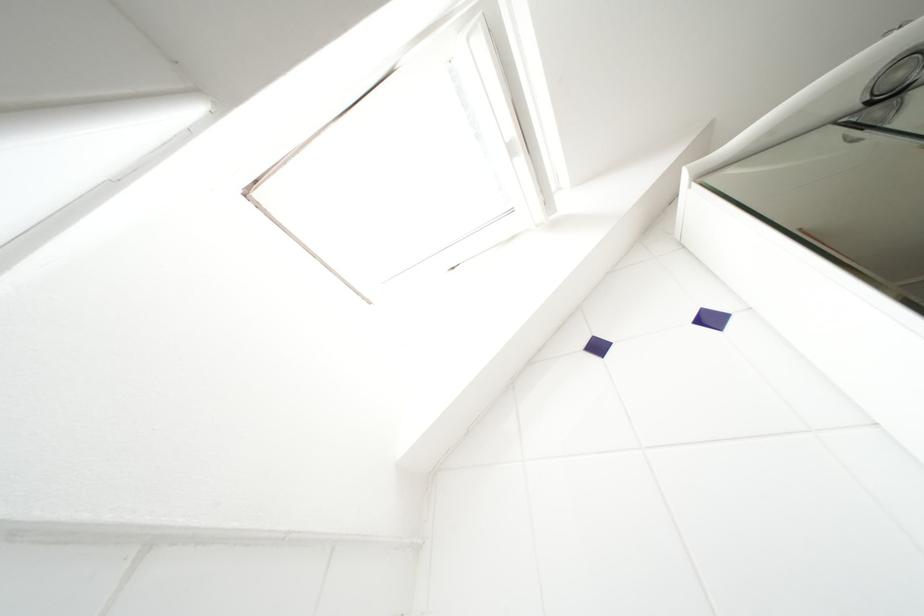
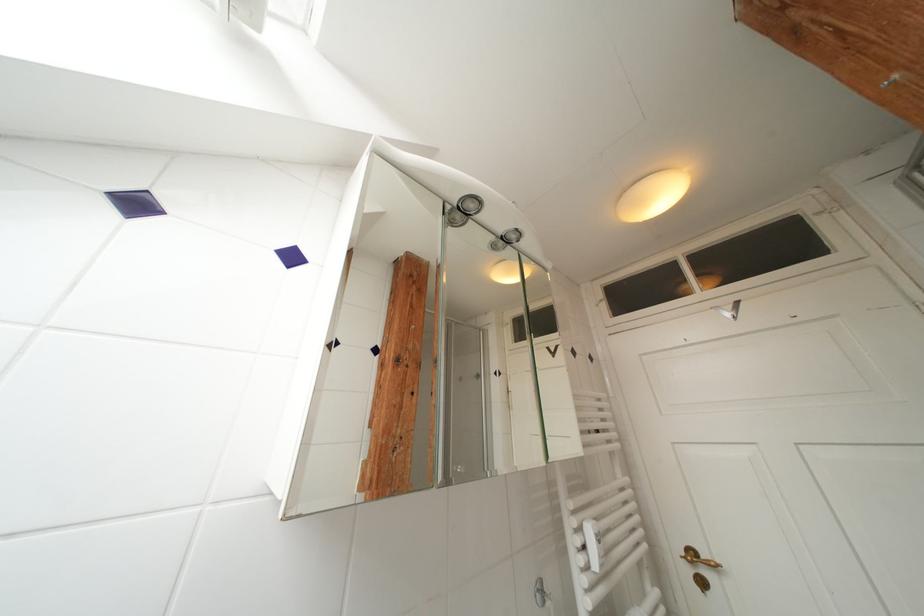
Question: The first image is from the beginning of the video and the second image is from the end. How did the camera likely rotate when shooting the video?

Choices:
 (A) Left
 (B) Right
 (C) Up
 (D) Down

Answer: (B)